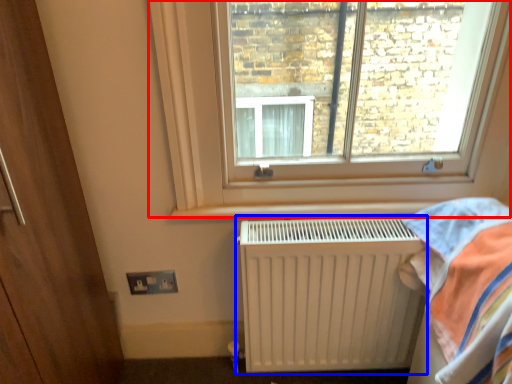
Question: Which point is closer to the camera, window (highlighted by a red box) or radiator (highlighted by a blue box)?

Choices:
 (A) window
 (B) radiator

Answer: (A)